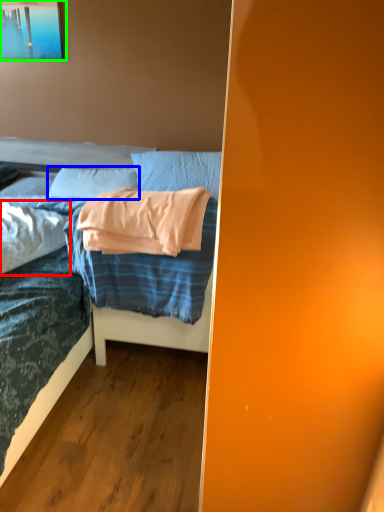
Question: Which is farther away from pillow (highlighted by a red box)? pillow (highlighted by a blue box) or picture frame (highlighted by a green box)?

Choices:
 (A) pillow
 (B) picture frame

Answer: (B)